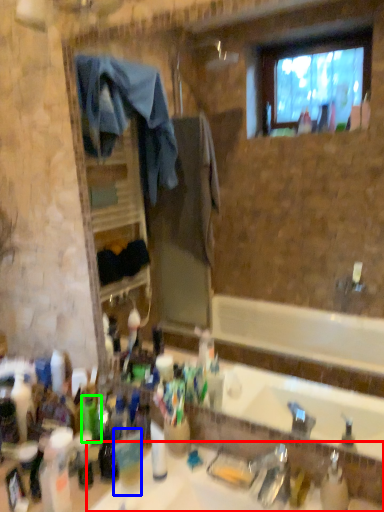
Question: Estimate the real-world distances between objects in this image. Which object is closer to sink (highlighted by a red box), coffee cup (highlighted by a blue box) or bottle (highlighted by a green box)?

Choices:
 (A) coffee cup
 (B) bottle

Answer: (A)